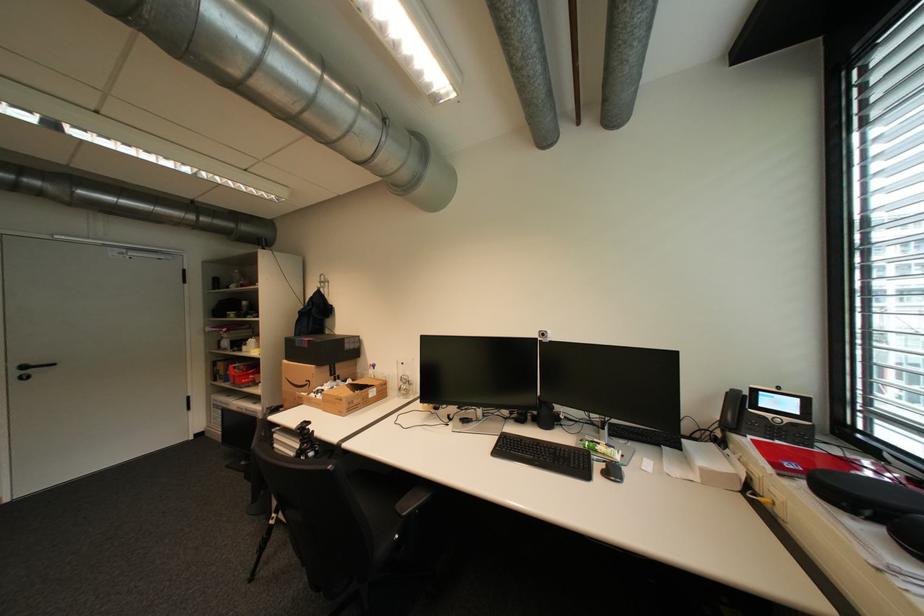
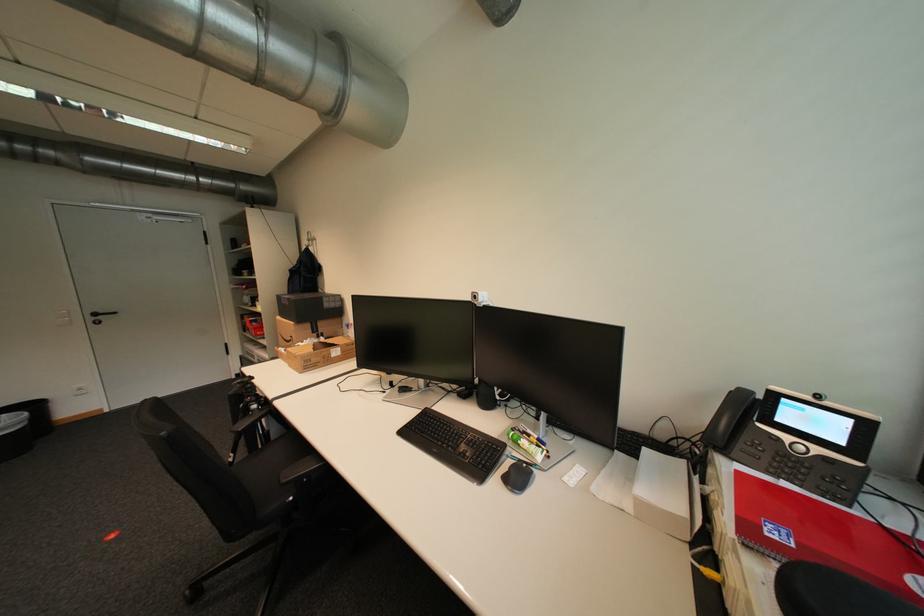
Question: The camera is either moving clockwise (left) or counter-clockwise (right) around the object. The first image is from the beginning of the video and the second image is from the end. Is the camera moving left or right when shooting the video?

Choices:
 (A) Left
 (B) Right

Answer: (B)